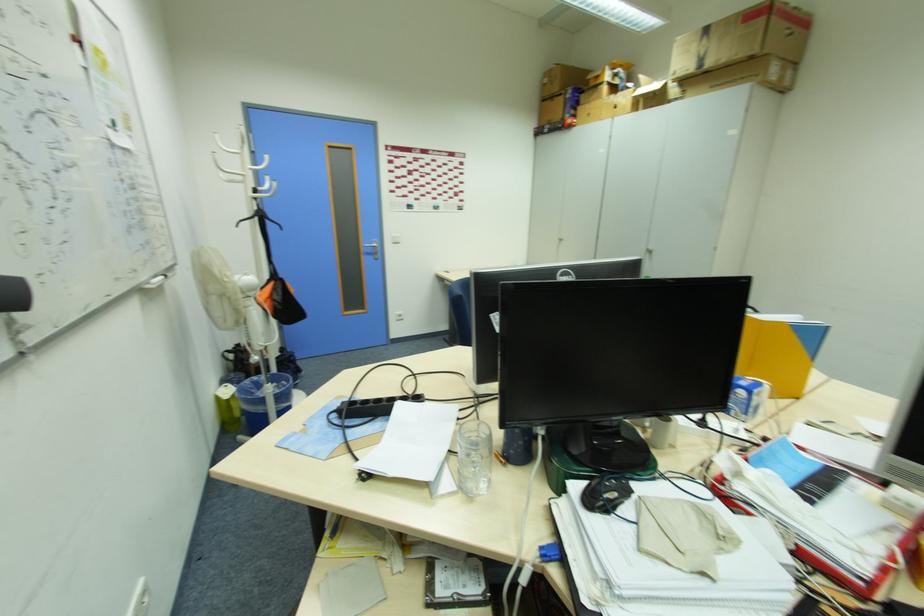
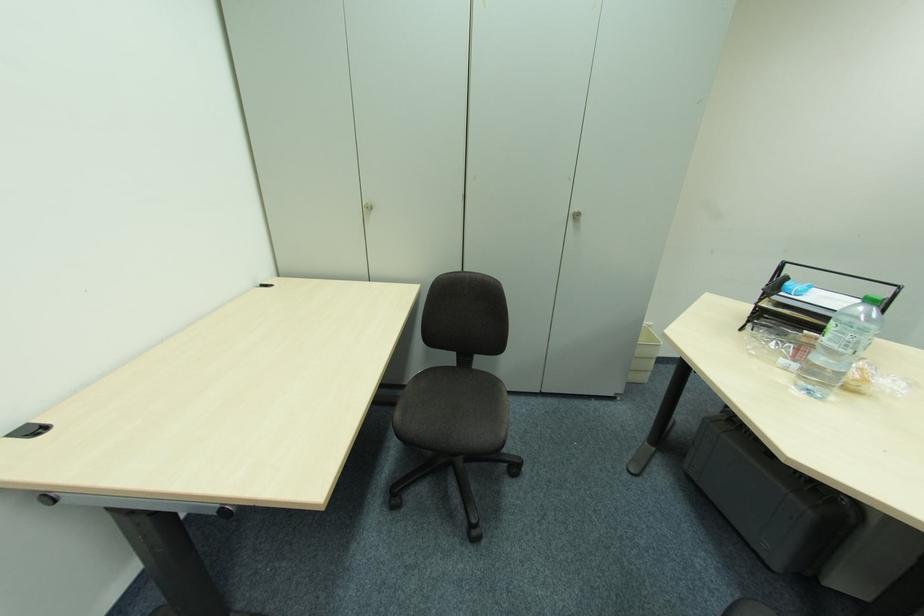
Where in the second image is the point corresponding to point 650,254 from the first image?

(574, 219)